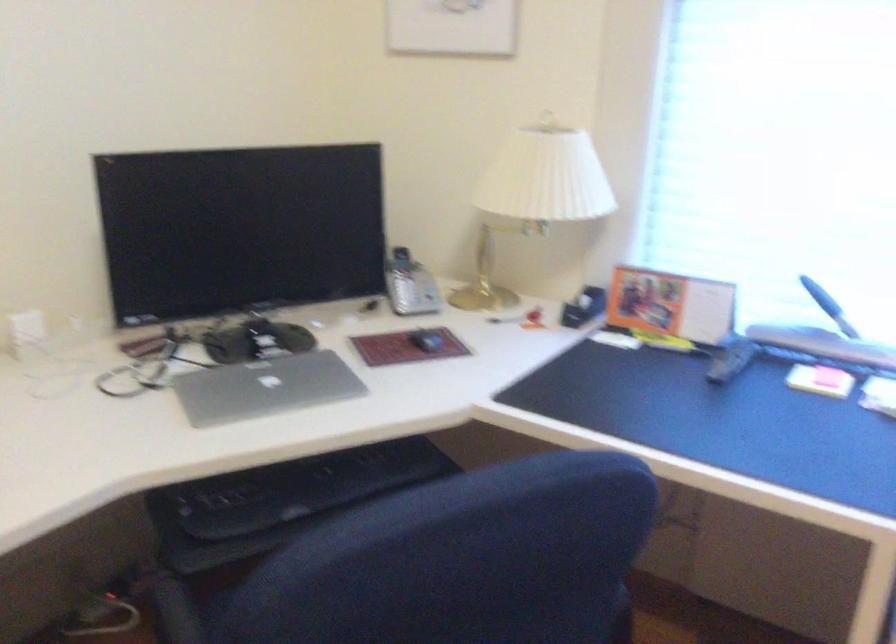
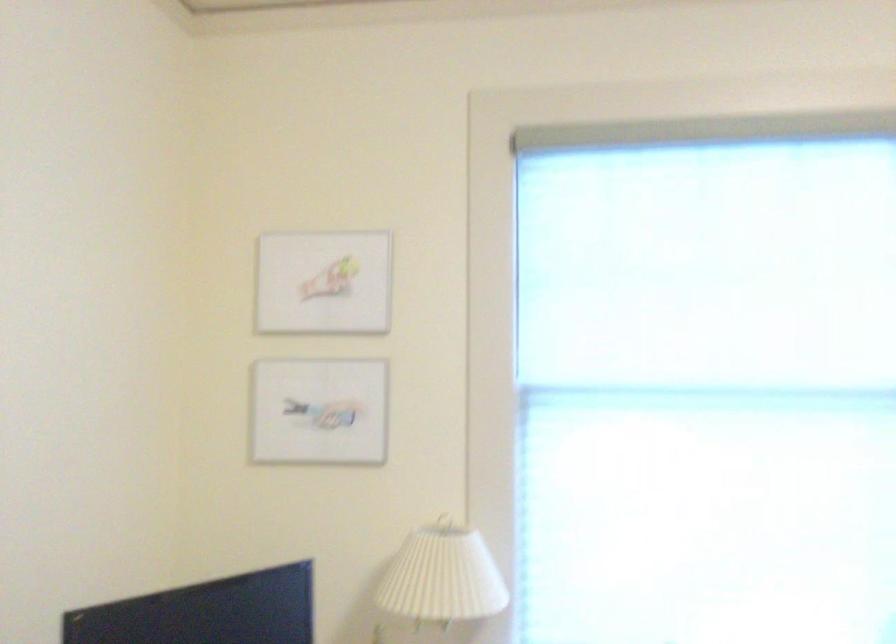
Based on the continuous images, in which direction is the camera rotating?

The camera's rotation is toward right-up.